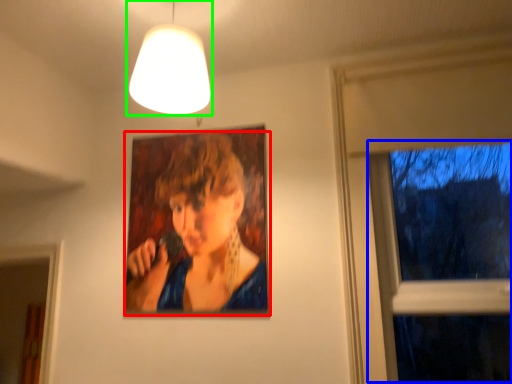
Question: Considering the real-world distances, which object is closest to person (highlighted by a red box)? window (highlighted by a blue box) or lamp (highlighted by a green box).

Choices:
 (A) window
 (B) lamp

Answer: (B)